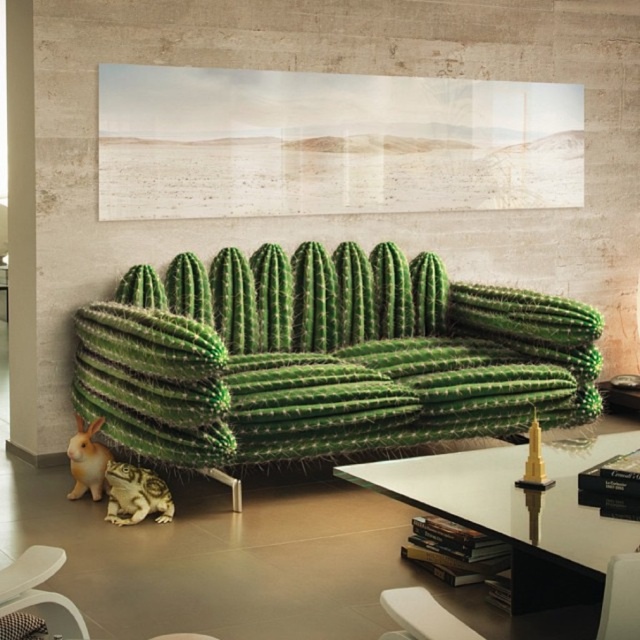
Does green textured cactus at lower left have a larger size compared to fluffy white rabbit at lower left?

Correct, green textured cactus at lower left is larger in size than fluffy white rabbit at lower left.

You are a GUI agent. You are given a task and a screenshot of the screen. Output one action in this format:
    pyautogui.click(x=<x>, y=<y>)
    Task: Click on the green textured cactus at lower left
    
    Given the screenshot: What is the action you would take?
    pyautogui.click(x=134, y=493)

Does point (168, 496) come in front of point (104, 467)?

Yes, point (168, 496) is closer to viewer.

At what (x,y) coordinates should I click in order to perform the action: click on green textured cactus at lower left. Please return your answer as a coordinate pair (x, y). The image size is (640, 640). Looking at the image, I should click on (134, 493).

Who is taller, green spiky cactus at center or transparent glass table at center?

Standing taller between the two is green spiky cactus at center.

Does point (458, 332) come in front of point (547, 596)?

No, (458, 332) is behind (547, 596).

The height and width of the screenshot is (640, 640). In order to click on green spiky cactus at center in this screenshot , I will do `click(324, 356)`.

Is transparent glass table at center to the left of green textured cactus at lower left from the viewer's perspective?

In fact, transparent glass table at center is to the right of green textured cactus at lower left.

The width and height of the screenshot is (640, 640). What are the coordinates of `transparent glass table at center` in the screenshot? It's located at (518, 512).